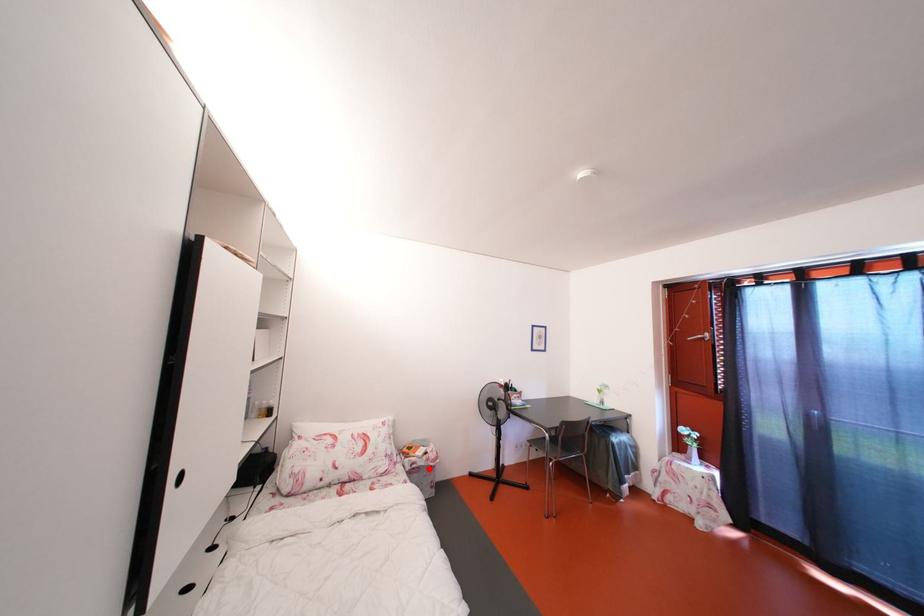
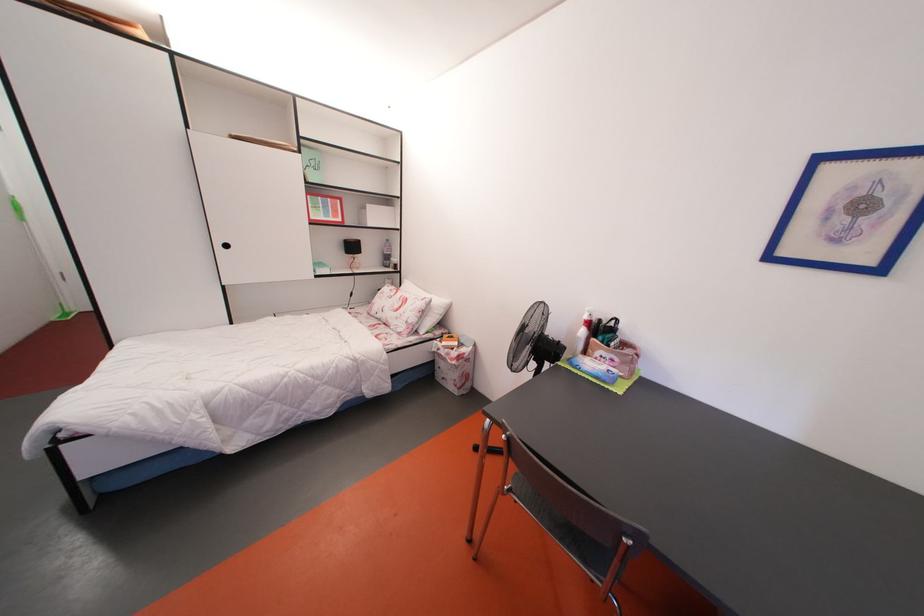
Question: I am providing you with two images of the same scene from different viewpoints. A red point is marked on the first image. Can you still see the location of the red point in image 2?

Choices:
 (A) Yes
 (B) No

Answer: (A)